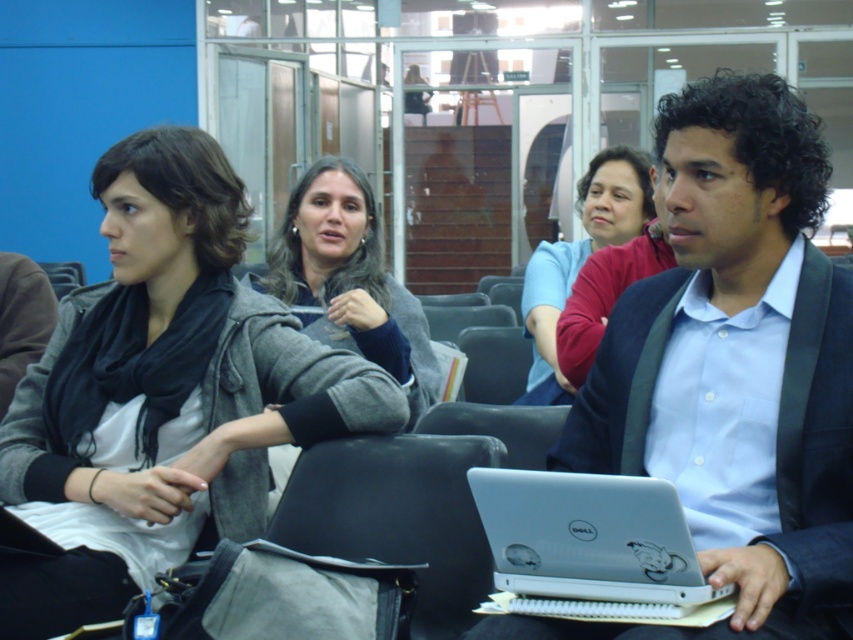
You are standing in the conference room and want to reach both the point at coordinates [57,628] and the point at coordinates [641,536]. Which point will you reach first if you move straight towards them?

The point at coordinates [57,628] is closer to you, so you will reach it first because it is further to the viewer than the other point.

From the picture: You are standing in the conference room and need to place a small item on the matte gray jacket at center. Based on its position, where should you aim to place the item?

The matte gray jacket at center is located at point coordinates 0.616 on the x and 0.192 on the y axis. Therefore, you should aim for those coordinates to place the item accurately.